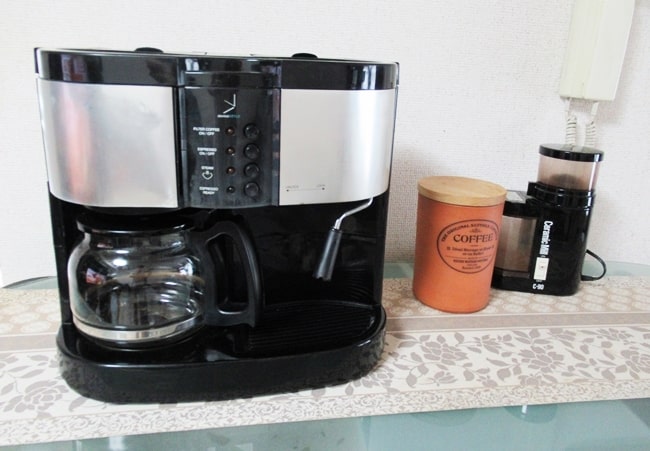
You are a GUI agent. You are given a task and a screenshot of the screen. Output one action in this format:
    pyautogui.click(x=<x>, y=<y>)
    Task: Click on the espresso/coffee maker shadow
    This screenshot has height=451, width=650.
    Given the screenshot: What is the action you would take?
    pyautogui.click(x=398, y=249)